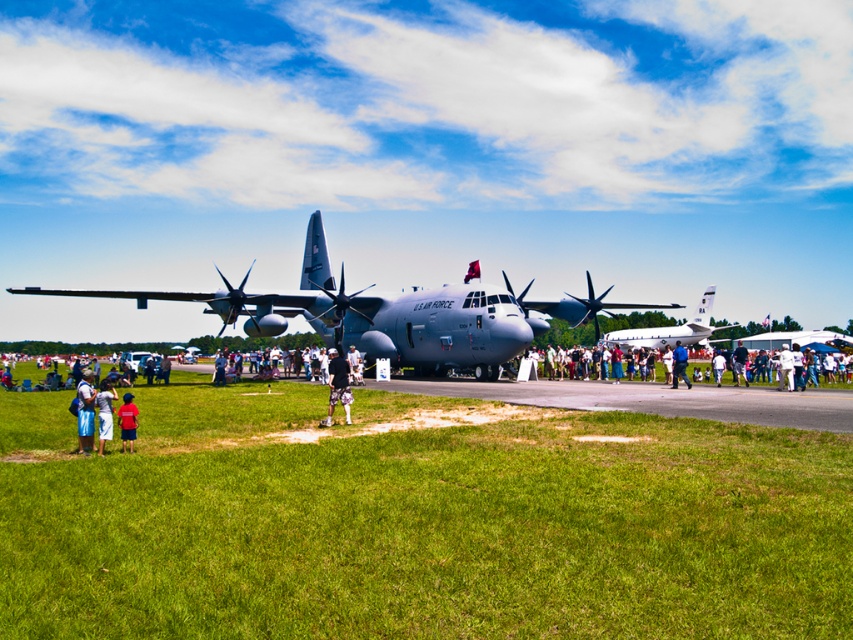
Who is lower down, matte gray airplane at center or dark blue uniform at center?

dark blue uniform at center is below.

Is point (434, 312) positioned in front of point (735, 384)?

That is False.

Find the location of a particular element. Image resolution: width=853 pixels, height=640 pixels. matte gray airplane at center is located at coordinates (383, 310).

Measure the distance between green grass at center and blue fabric shirt at center.

green grass at center and blue fabric shirt at center are 14.50 meters apart.

This screenshot has width=853, height=640. What do you see at coordinates (416, 522) in the screenshot? I see `green grass at center` at bounding box center [416, 522].

Find the location of a particular element. The height and width of the screenshot is (640, 853). green grass at center is located at coordinates (416, 522).

Where is `green grass at center`? Image resolution: width=853 pixels, height=640 pixels. green grass at center is located at coordinates (416, 522).

Between point (611, 332) and point (734, 365), which one is positioned behind?

Point (611, 332)

Find the location of a particular element. This screenshot has width=853, height=640. metallic silver airplane at center is located at coordinates (668, 328).